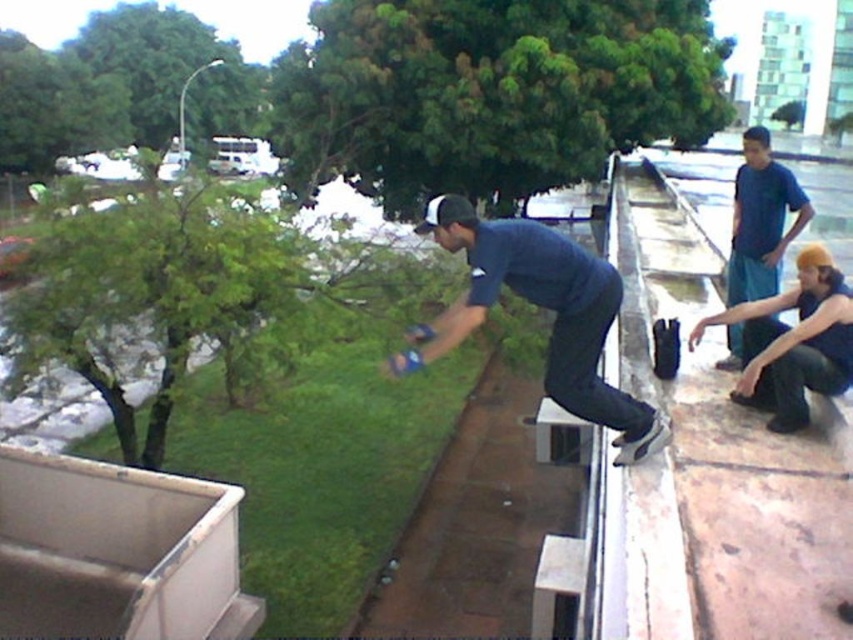
You are a photographer trying to capture a wide shot of the scene. The camera you are using has a maximum width capacity of 1.2 meters. Based on the objects in the scene, can you determine if the dark blue denim jeans at center and the dark blue fabric squat at lower right will fit within the camera frame width?

The dark blue denim jeans at center might be wider than dark blue fabric squat at lower right, so the total width of both objects combined may exceed the camera frame width of 1.2 meters. It is uncertain if they will fit without further information on their exact dimensions.

You are a photographer trying to capture the skateboarder on the rooftop. You need to position yourself so that your camera is directly facing the dark blue denim jeans at center. According to the coordinates provided, where should you aim your camera?

The dark blue denim jeans at center is located at point (x=540, y=307), so you should aim your camera at those coordinates to face it directly.